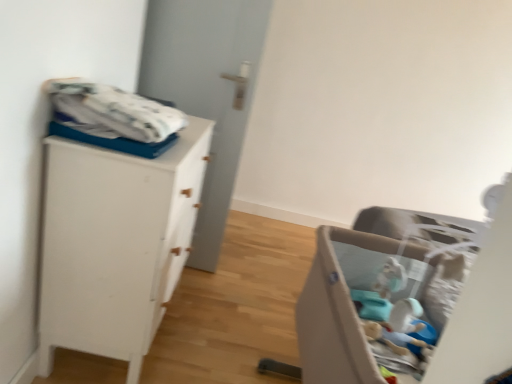
Question: Is beige fabric playpen at lower right aimed at white matte door at center?

Choices:
 (A) no
 (B) yes

Answer: (A)

Question: Considering the relative sizes of beige fabric playpen at lower right and white matte door at center in the image provided, is beige fabric playpen at lower right taller than white matte door at center?

Choices:
 (A) yes
 (B) no

Answer: (B)

Question: From a real-world perspective, is beige fabric playpen at lower right below white matte door at center?

Choices:
 (A) no
 (B) yes

Answer: (B)

Question: From the image's perspective, would you say beige fabric playpen at lower right is positioned over white matte door at center?

Choices:
 (A) no
 (B) yes

Answer: (A)

Question: Is the surface of beige fabric playpen at lower right in direct contact with white matte door at center?

Choices:
 (A) yes
 (B) no

Answer: (B)

Question: Considering the relative sizes of beige fabric playpen at lower right and white matte door at center in the image provided, is beige fabric playpen at lower right smaller than white matte door at center?

Choices:
 (A) no
 (B) yes

Answer: (A)

Question: From a real-world perspective, is white cotton blanket at upper left positioned under white matte door at center based on gravity?

Choices:
 (A) no
 (B) yes

Answer: (A)

Question: Considering the relative sizes of white cotton blanket at upper left and white matte door at center in the image provided, is white cotton blanket at upper left taller than white matte door at center?

Choices:
 (A) no
 (B) yes

Answer: (A)

Question: Can you confirm if white cotton blanket at upper left is shorter than white matte door at center?

Choices:
 (A) no
 (B) yes

Answer: (B)

Question: Can you confirm if white cotton blanket at upper left is smaller than white matte door at center?

Choices:
 (A) no
 (B) yes

Answer: (B)

Question: From a real-world perspective, is white cotton blanket at upper left over white matte door at center?

Choices:
 (A) yes
 (B) no

Answer: (A)

Question: Can you confirm if white cotton blanket at upper left is wider than white matte door at center?

Choices:
 (A) no
 (B) yes

Answer: (B)

Question: Would you say white cotton blanket at upper left is a long distance from beige fabric playpen at lower right?

Choices:
 (A) yes
 (B) no

Answer: (B)